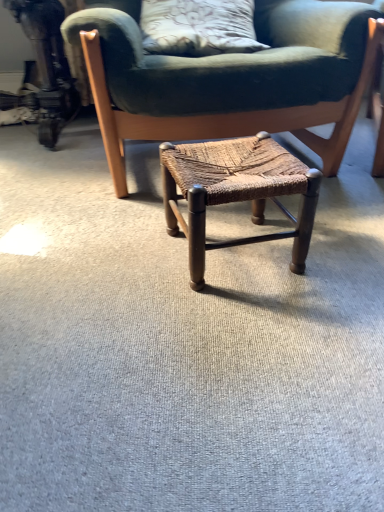
Question: Is brown woven stool at center in front of or behind woven wood stool at center in the image?

Choices:
 (A) front
 (B) behind

Answer: (B)

Question: Considering the positions of brown woven stool at center and woven wood stool at center in the image, is brown woven stool at center taller or shorter than woven wood stool at center?

Choices:
 (A) tall
 (B) short

Answer: (A)

Question: Is brown woven stool at center inside or outside of woven wood stool at center?

Choices:
 (A) outside
 (B) inside

Answer: (A)

Question: Considering their positions, is woven wood stool at center located in front of or behind brown woven stool at center?

Choices:
 (A) behind
 (B) front

Answer: (B)

Question: From the image's perspective, is woven wood stool at center above or below brown woven stool at center?

Choices:
 (A) above
 (B) below

Answer: (B)

Question: From their relative heights in the image, would you say woven wood stool at center is taller or shorter than brown woven stool at center?

Choices:
 (A) short
 (B) tall

Answer: (A)

Question: Choose the correct answer: Is woven wood stool at center inside brown woven stool at center or outside it?

Choices:
 (A) inside
 (B) outside

Answer: (B)